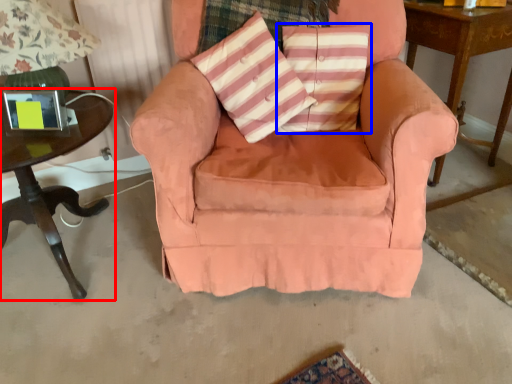
Question: Which point is closer to the camera, table (highlighted by a red box) or pillow (highlighted by a blue box)?

Choices:
 (A) table
 (B) pillow

Answer: (A)